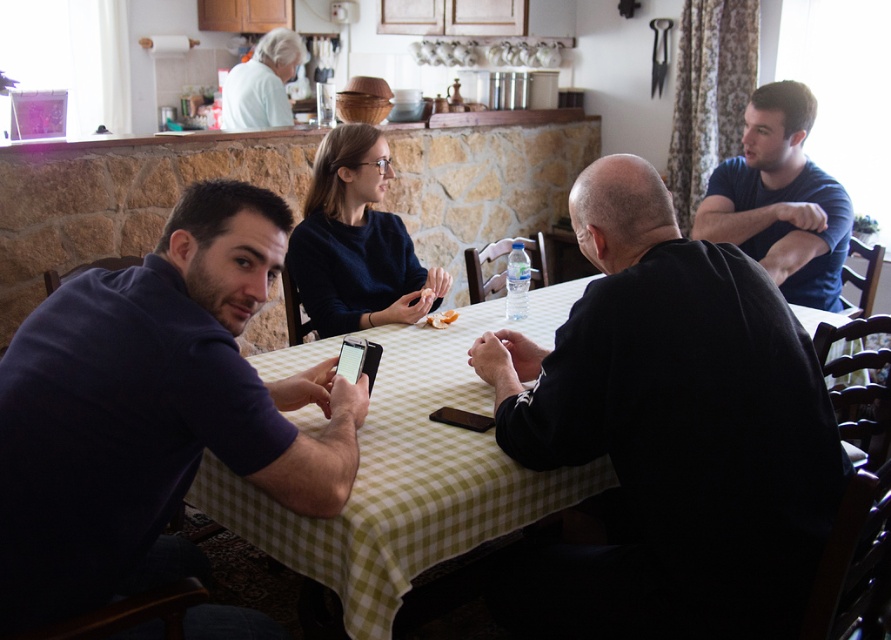
Question: Does dark blue cotton shirt at left appear under dark blue t-shirt at right?

Choices:
 (A) no
 (B) yes

Answer: (B)

Question: Estimate the real-world distances between objects in this image. Which object is farther from the dark blue t-shirt at right?

Choices:
 (A) dark blue cotton shirt at left
 (B) black matte shirt at center
 (C) green checkered tablecloth at center

Answer: (A)

Question: From the image, what is the correct spatial relationship of black matte shirt at center in relation to green checkered tablecloth at center?

Choices:
 (A) right
 (B) left

Answer: (A)

Question: Which of the following is the closest to the observer?

Choices:
 (A) (734, 243)
 (B) (568, 477)

Answer: (B)

Question: Which is nearer to the green checkered tablecloth at center?

Choices:
 (A) black matte shirt at center
 (B) dark blue t-shirt at right
 (C) dark blue cotton shirt at left

Answer: (C)

Question: Can you confirm if black matte shirt at center is positioned to the left of green checkered tablecloth at center?

Choices:
 (A) yes
 (B) no

Answer: (B)